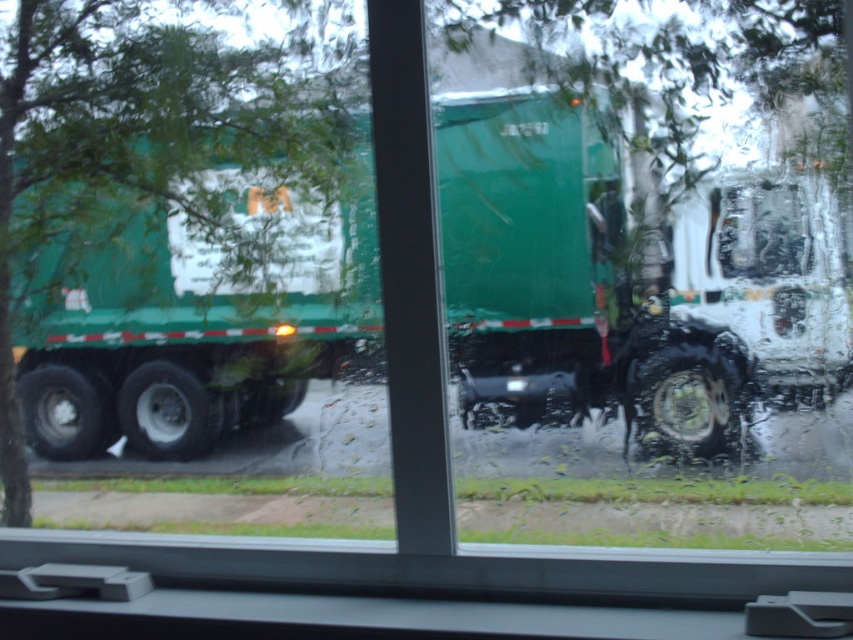
Describe the element at coordinates (177, 228) in the screenshot. Image resolution: width=853 pixels, height=640 pixels. I see `green leafy tree at left` at that location.

Who is positioned more to the right, green leafy tree at left or shiny metallic truck at center?

Positioned to the right is shiny metallic truck at center.

Find the location of a particular element. green leafy tree at left is located at coordinates (177, 228).